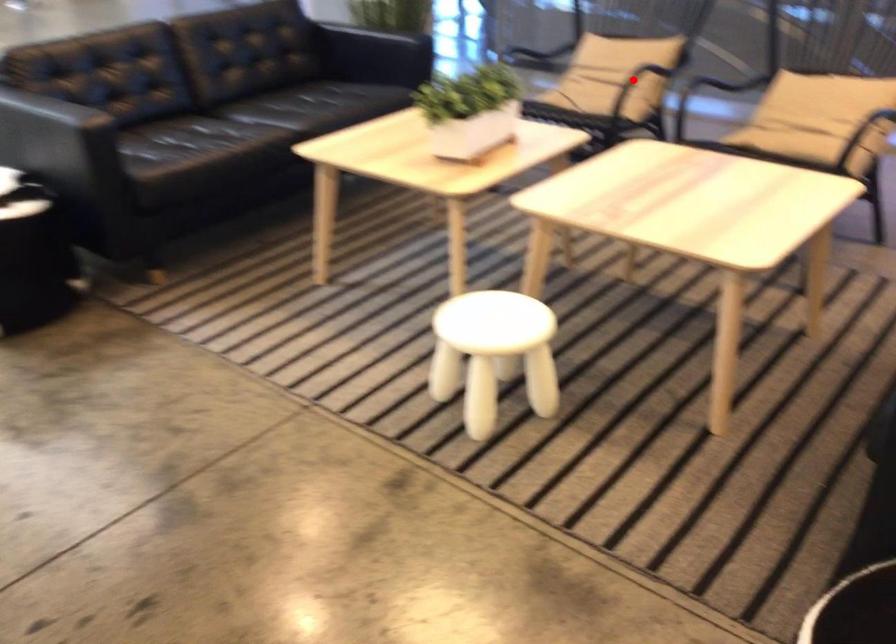
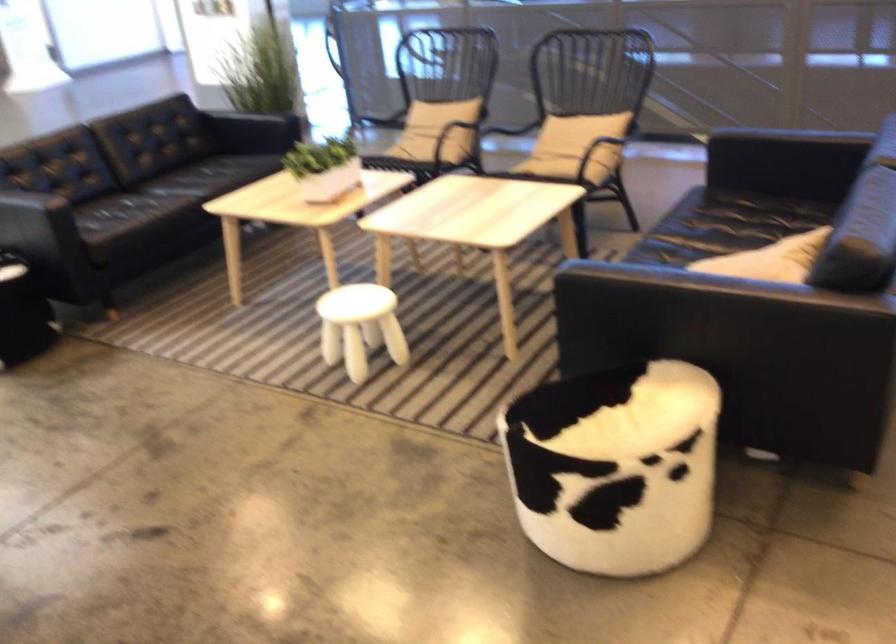
Question: A red point is marked in image1. In image2, is the corresponding 3D point closer to the camera or farther? Reply with the corresponding letter.

Choices:
 (A) The corresponding 3D point is closer.
 (B) The corresponding 3D point is farther.

Answer: (B)